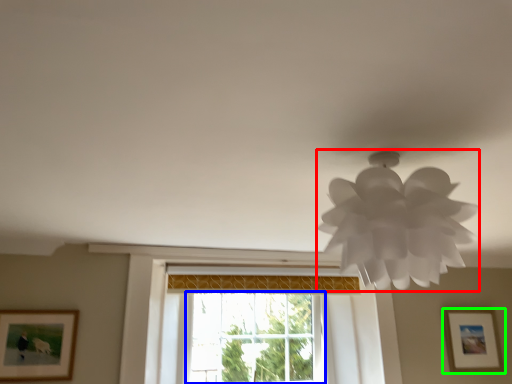
Question: Estimate the real-world distances between objects in this image. Which object is closer to lamp (highlighted by a red box), window (highlighted by a blue box) or picture frame (highlighted by a green box)?

Choices:
 (A) window
 (B) picture frame

Answer: (A)